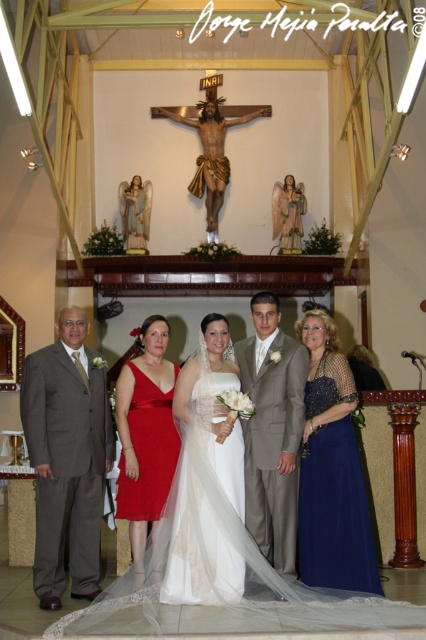
In the church wedding scene, there is a matte red dress at center and a wooden crucifix at center. From the perspective of someone standing at the entrance facing the altar, which object is positioned to the left?

The matte red dress at center is to the left of the wooden crucifix at center, so the matte red dress at center is positioned to the left.

In the church wedding scene, there is a white tulle dress at center and a wooden crucifix at center. Which object is taller?

The white tulle dress at center is taller than the wooden crucifix at center.

You are a photographer at the back of the church. You want to take a photo of the white tulle dress at center and the wooden crucifix at center. Which one is more to the left?

The white tulle dress at center is more to the left than the wooden crucifix at center.